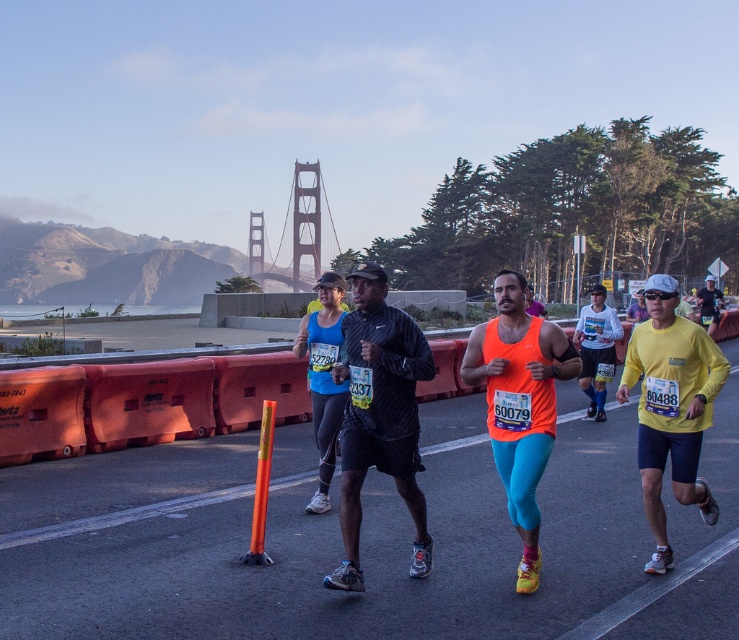
Question: Is yellow fabric shirt at right bigger than metallic bridge at upper center?

Choices:
 (A) yes
 (B) no

Answer: (B)

Question: Among these points, which one is farthest from the camera?

Choices:
 (A) (285, 269)
 (B) (670, 291)

Answer: (A)

Question: Observing the image, what is the correct spatial positioning of yellow fabric shirt at right in reference to metallic bridge at upper center?

Choices:
 (A) above
 (B) below

Answer: (B)

Question: Which of the following is the closest to the observer?

Choices:
 (A) yellow fabric shirt at right
 (B) metallic bridge at upper center

Answer: (A)

Question: Does yellow fabric shirt at right have a larger size compared to metallic bridge at upper center?

Choices:
 (A) yes
 (B) no

Answer: (B)